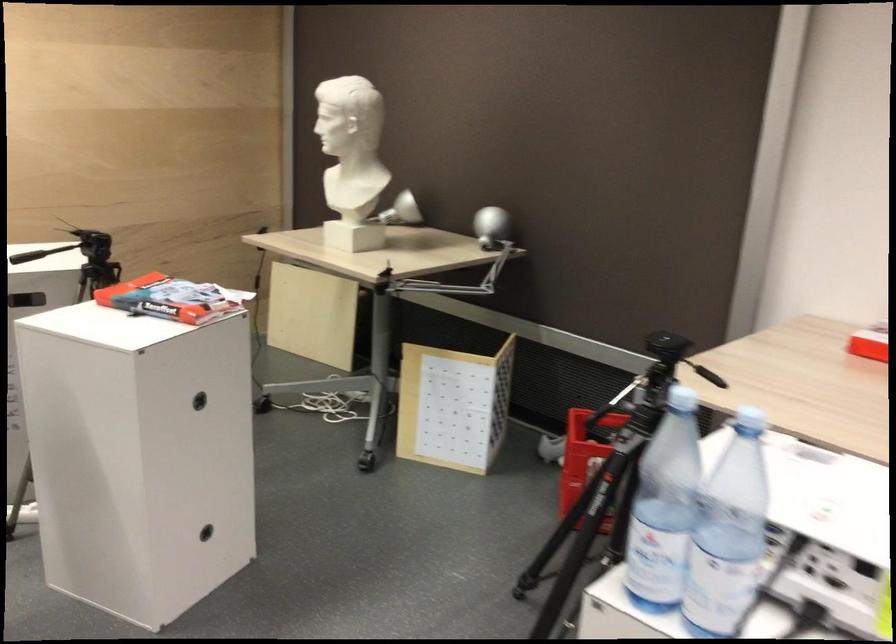
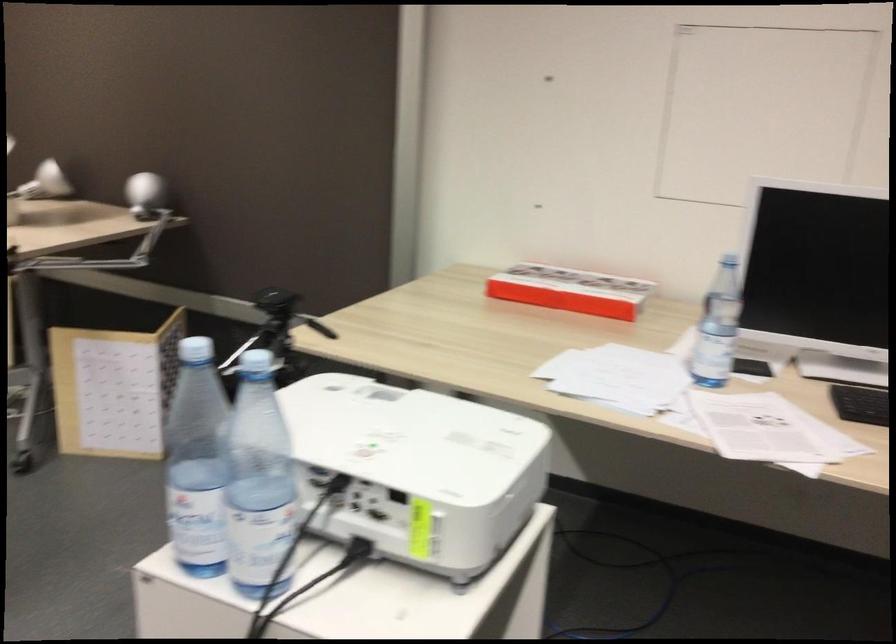
The point at (719, 529) is marked in the first image. Where is the corresponding point in the second image?

(259, 482)